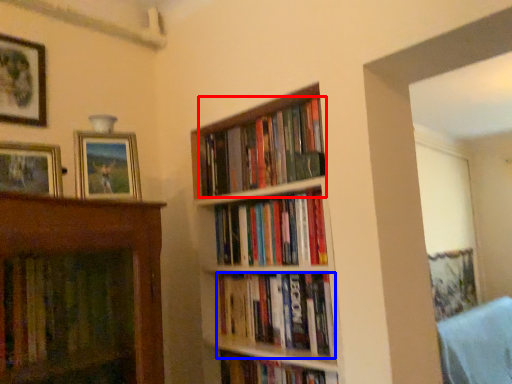
Question: Which point is further to the camera, book (highlighted by a red box) or book (highlighted by a blue box)?

Choices:
 (A) book
 (B) book

Answer: (A)